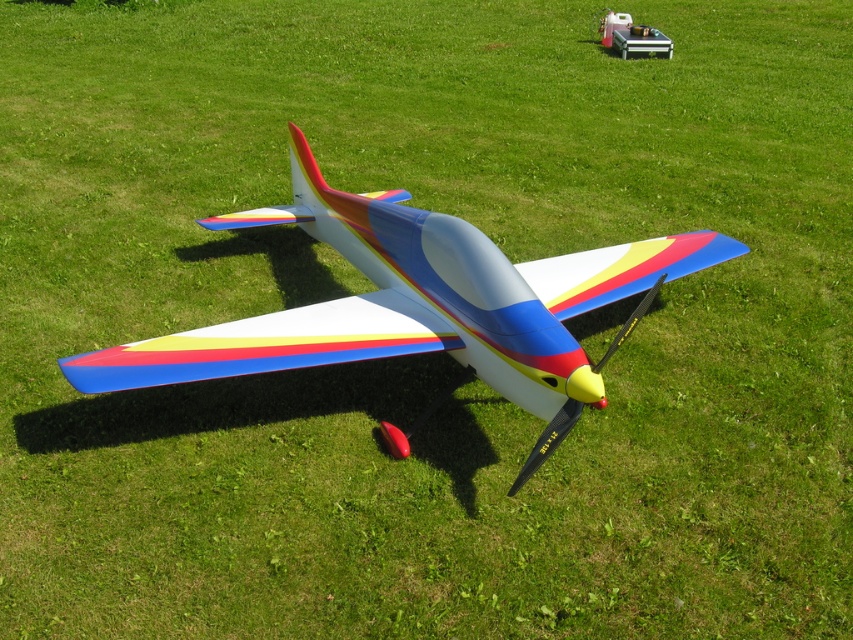
Question: Does matte plastic airplane at center come behind metallic silver toolbox at upper center?

Choices:
 (A) yes
 (B) no

Answer: (B)

Question: Does matte plastic airplane at center appear on the right side of metallic silver toolbox at upper center?

Choices:
 (A) yes
 (B) no

Answer: (B)

Question: Which of the following is the closest to the observer?

Choices:
 (A) metallic silver toolbox at upper center
 (B) matte plastic airplane at center

Answer: (B)

Question: Observing the image, what is the correct spatial positioning of matte plastic airplane at center in reference to metallic silver toolbox at upper center?

Choices:
 (A) left
 (B) right

Answer: (A)

Question: Which of the following is the farthest from the observer?

Choices:
 (A) (469, 310)
 (B) (630, 42)

Answer: (B)